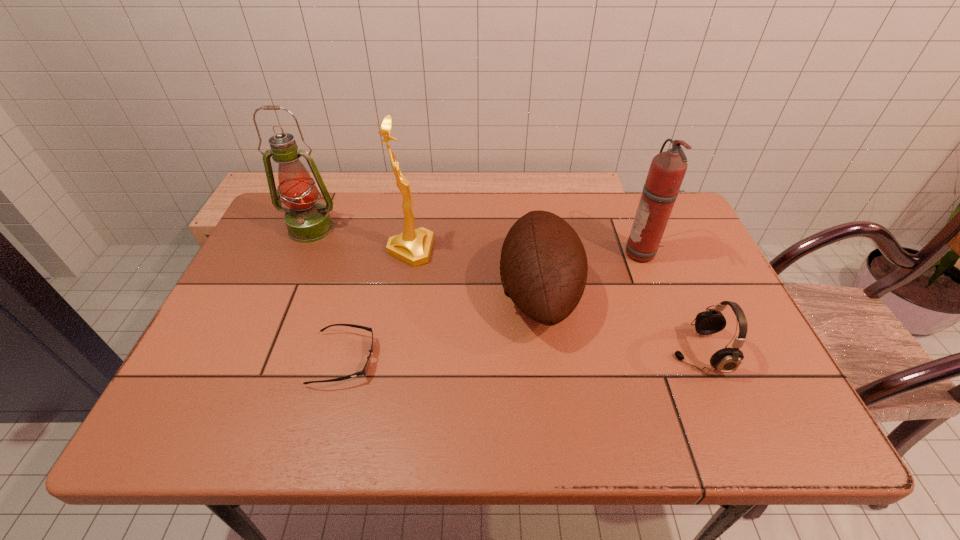
Select which object is the fourth closest to the third shortest object. Please provide its 2D coordinates. Your answer should be formatted as a tuple, i.e. [(x, y)], where the tuple contains the x and y coordinates of a point satisfying the conditions above.

[(364, 372)]

Locate an element on the screen. This screenshot has width=960, height=540. object that is the second closest to the award is located at coordinates (543, 267).